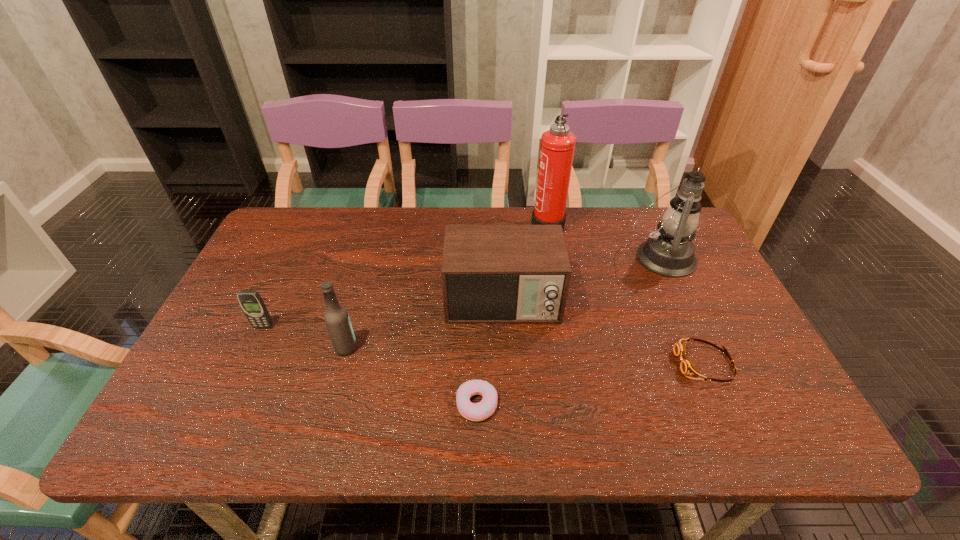
Locate an element on the screen. vacant space located on the front-facing side of the tallest object is located at coordinates 468,224.

Locate an element on the screen. This screenshot has height=540, width=960. vacant point located 0.360m on the front-facing side of the tallest object is located at coordinates (420, 224).

Locate an element on the screen. free space located 0.380m on the front-facing side of the tallest object is located at coordinates (414, 224).

The width and height of the screenshot is (960, 540). I want to click on vacant space located 0.150m on the back of the oil lamp, so click(x=639, y=211).

Where is `vacant space situated on the side of the second object from left to right with the label`? The width and height of the screenshot is (960, 540). vacant space situated on the side of the second object from left to right with the label is located at coordinates (382, 348).

Where is `free space located on the front-facing side of the radio receiver`? This screenshot has height=540, width=960. free space located on the front-facing side of the radio receiver is located at coordinates (506, 359).

At what (x,y) coordinates should I click in order to perform the action: click on vacant region located on the screen of the leftmost object. Please return your answer as a coordinate pair (x, y). This screenshot has height=540, width=960. Looking at the image, I should click on (213, 433).

You are a GUI agent. You are given a task and a screenshot of the screen. Output one action in this format:
    pyautogui.click(x=<x>, y=<y>)
    Task: Click on the vacant space situated with the lenses facing forward on the goggles
    Image resolution: width=960 pixels, height=540 pixels.
    Given the screenshot: What is the action you would take?
    pyautogui.click(x=638, y=363)

You are a GUI agent. You are given a task and a screenshot of the screen. Output one action in this format:
    pyautogui.click(x=<x>, y=<y>)
    Task: Click on the free spot located with the lenses facing forward on the goggles
    
    Given the screenshot: What is the action you would take?
    pyautogui.click(x=651, y=363)

Identify the location of blank space located with the lenses facing forward on the goggles. The image size is (960, 540). click(x=617, y=363).